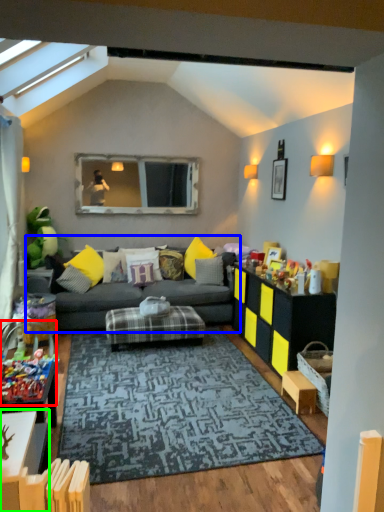
Question: Which object is the farthest from toy (highlighted by a red box)? Choose among these: studio couch (highlighted by a blue box) or table (highlighted by a green box).

Choices:
 (A) studio couch
 (B) table

Answer: (A)